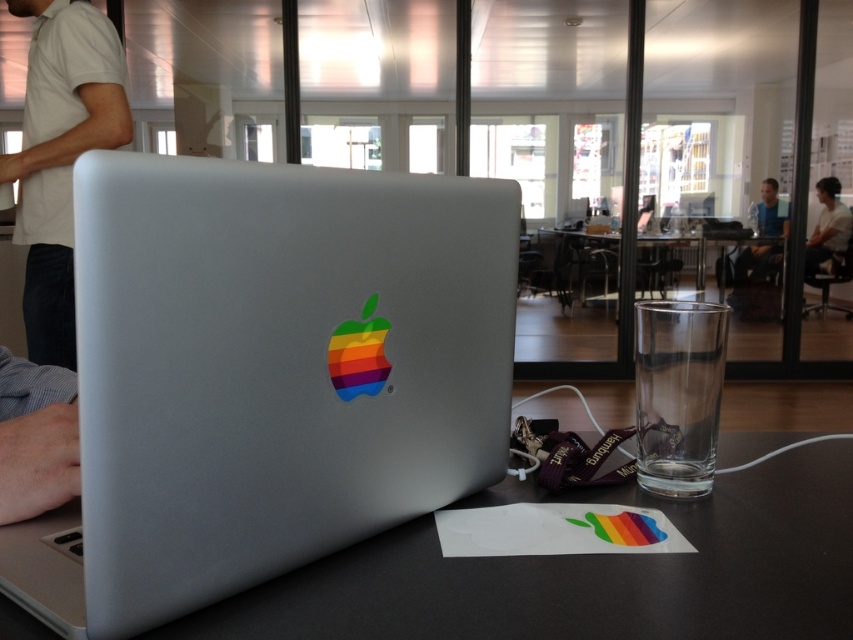
Question: Does black matte table at center appear on the right side of white cotton shirt at upper left?

Choices:
 (A) yes
 (B) no

Answer: (A)

Question: Which point is farther from the camera taking this photo?

Choices:
 (A) (764, 193)
 (B) (814, 259)
 (C) (447, 493)

Answer: (B)

Question: Estimate the real-world distances between objects in this image. Which object is farther from the black matte table at center?

Choices:
 (A) white cotton shirt at upper left
 (B) matte blue shirt at upper right
 (C) satin silver laptop at center

Answer: (B)

Question: Does black matte table at center appear on the right side of white cotton shirt at upper left?

Choices:
 (A) yes
 (B) no

Answer: (A)

Question: Can you confirm if black matte table at center is thinner than matte blue shirt at upper right?

Choices:
 (A) no
 (B) yes

Answer: (A)

Question: Estimate the real-world distances between objects in this image. Which object is farther from the black matte table at center?

Choices:
 (A) white shirt at upper right
 (B) satin silver laptop at center
 (C) white cotton shirt at upper left

Answer: (A)